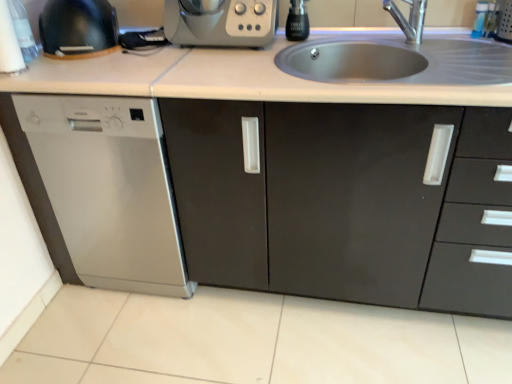
The image size is (512, 384). Describe the element at coordinates (401, 62) in the screenshot. I see `stainless steel sink at upper center` at that location.

The height and width of the screenshot is (384, 512). What do you see at coordinates (297, 21) in the screenshot? I see `black glass bottle at upper center, the second appliance viewed from the left` at bounding box center [297, 21].

This screenshot has width=512, height=384. What are the coordinates of `satin silver appliance at upper center` in the screenshot? It's located at (221, 22).

Considering the relative sizes of satin silver appliance at upper center and stainless steel sink at upper center in the image provided, is satin silver appliance at upper center thinner than stainless steel sink at upper center?

Indeed, satin silver appliance at upper center has a lesser width compared to stainless steel sink at upper center.

Is satin silver appliance at upper center in front of or behind stainless steel sink at upper center in the image?

satin silver appliance at upper center is positioned farther from the viewer than stainless steel sink at upper center.

Could you tell me if satin silver appliance at upper center is facing stainless steel sink at upper center?

No, satin silver appliance at upper center is not turned towards stainless steel sink at upper center.

Who is smaller, matte black cabinet at center or satin steel dishwasher at left?

satin steel dishwasher at left is smaller.

Is matte black cabinet at center facing away from satin steel dishwasher at left?

No.

Consider the image. Which of these two, matte black cabinet at center or satin steel dishwasher at left, stands shorter?

matte black cabinet at center is shorter.

Who is more distant, matte black cabinet at center or satin steel dishwasher at left?

Positioned behind is satin steel dishwasher at left.

Is silver metallic faucet at upper center located outside matte black cabinet at center?

Absolutely, silver metallic faucet at upper center is external to matte black cabinet at center.

Is the depth of silver metallic faucet at upper center less than that of matte black cabinet at center?

No, it is behind matte black cabinet at center.

From the image's perspective, is silver metallic faucet at upper center positioned above or below matte black cabinet at center?

From the image's perspective, silver metallic faucet at upper center appears above matte black cabinet at center.

Can you confirm if black glass bottle at upper center, the second appliance viewed from the left, is thinner than silver metallic faucet at upper center?

Yes, black glass bottle at upper center, the second appliance viewed from the left, is thinner than silver metallic faucet at upper center.

Is the position of black glass bottle at upper center, acting as the first appliance starting from the right, more distant than that of silver metallic faucet at upper center?

That is True.

Can you tell me how much black glass bottle at upper center, acting as the first appliance starting from the right, and silver metallic faucet at upper center differ in facing direction?

The angle between the facing direction of black glass bottle at upper center, acting as the first appliance starting from the right, and the facing direction of silver metallic faucet at upper center is 51.2 degrees.

Measure the distance from black glass bottle at upper center, the second appliance viewed from the left, to silver metallic faucet at upper center.

black glass bottle at upper center, the second appliance viewed from the left, is 13.24 inches from silver metallic faucet at upper center.

From a real-world perspective, which is physically below, satin silver appliance at upper center or matte black kettle at upper left, the second appliance when ordered from right to left?

satin silver appliance at upper center is physically lower.

I want to click on kitchen appliance in front of the matte black kettle at upper left, which is the 1th appliance in left-to-right order, so click(221, 22).

Is satin silver appliance at upper center turned away from matte black kettle at upper left, which is the 1th appliance in left-to-right order?

No, matte black kettle at upper left, which is the 1th appliance in left-to-right order, is not at the back of satin silver appliance at upper center.

Between satin silver appliance at upper center and matte black kettle at upper left, the second appliance when ordered from right to left, which one has less height?

With less height is satin silver appliance at upper center.

The width and height of the screenshot is (512, 384). Identify the location of sink located above the satin steel dishwasher at left (from the image's perspective). (401, 62).

Is stainless steel sink at upper center oriented towards satin steel dishwasher at left?

No, stainless steel sink at upper center is not facing towards satin steel dishwasher at left.

Between stainless steel sink at upper center and satin steel dishwasher at left, which one has more height?

With more height is satin steel dishwasher at left.

Is point (459, 49) closer to viewer compared to point (41, 160)?

No, it is behind (41, 160).

From a real-world perspective, between satin steel dishwasher at left and silver metallic faucet at upper center, who is vertically lower?

In real-world perspective, satin steel dishwasher at left is lower.

From the image's perspective, does satin steel dishwasher at left appear higher than silver metallic faucet at upper center?

No.

Which of these two, satin steel dishwasher at left or silver metallic faucet at upper center, is bigger?

Bigger between the two is satin steel dishwasher at left.

Is satin steel dishwasher at left facing towards silver metallic faucet at upper center?

No.

This screenshot has width=512, height=384. Find the location of `kitchen appliance located behind the stainless steel sink at upper center`. kitchen appliance located behind the stainless steel sink at upper center is located at coordinates (221, 22).

The height and width of the screenshot is (384, 512). I want to click on home appliance located on the left of matte black cabinet at center, so click(106, 189).

Considering their positions, is black glass bottle at upper center, acting as the first appliance starting from the right, positioned further to stainless steel sink at upper center than matte black cabinet at center?

The object further to stainless steel sink at upper center is matte black cabinet at center.

Looking at the image, which one is located further to silver metallic faucet at upper center, matte black kettle at upper left, the second appliance when ordered from right to left, or stainless steel sink at upper center?

Based on the image, matte black kettle at upper left, the second appliance when ordered from right to left, appears to be further to silver metallic faucet at upper center.

Looking at this image, which object lies further to the anchor point black glass bottle at upper center, acting as the first appliance starting from the right, matte black kettle at upper left, the second appliance when ordered from right to left, or matte black cabinet at center?

matte black cabinet at center.

Based on their spatial positions, is black glass bottle at upper center, acting as the first appliance starting from the right, or stainless steel sink at upper center further from satin silver appliance at upper center?

stainless steel sink at upper center.

From the image, which object appears to be farther from satin silver appliance at upper center, silver metallic faucet at upper center or stainless steel sink at upper center?

Based on the image, silver metallic faucet at upper center appears to be further to satin silver appliance at upper center.

Estimate the real-world distances between objects in this image. Which object is closer to stainless steel sink at upper center, matte black cabinet at center or black glass bottle at upper center, the second appliance viewed from the left?

Based on the image, black glass bottle at upper center, the second appliance viewed from the left, appears to be nearer to stainless steel sink at upper center.

Estimate the real-world distances between objects in this image. Which object is closer to matte black kettle at upper left, which is the 1th appliance in left-to-right order, silver metallic faucet at upper center or black glass bottle at upper center, acting as the first appliance starting from the right?

Among the two, black glass bottle at upper center, acting as the first appliance starting from the right, is located nearer to matte black kettle at upper left, which is the 1th appliance in left-to-right order.

Estimate the real-world distances between objects in this image. Which object is further from stainless steel sink at upper center, matte black cabinet at center or satin steel dishwasher at left?

satin steel dishwasher at left is positioned further to the anchor stainless steel sink at upper center.

Where is `sink between silver metallic faucet at upper center and matte black cabinet at center from top to bottom`? The height and width of the screenshot is (384, 512). sink between silver metallic faucet at upper center and matte black cabinet at center from top to bottom is located at coordinates (401, 62).

Identify the location of kitchen appliance between satin steel dishwasher at left and matte black cabinet at center. (221, 22).

In order to click on home appliance situated between matte black kettle at upper left, the second appliance when ordered from right to left, and stainless steel sink at upper center from left to right in this screenshot , I will do `click(106, 189)`.

This screenshot has width=512, height=384. Find the location of `kitchen appliance located between matte black kettle at upper left, which is the 1th appliance in left-to-right order, and matte black cabinet at center in the left-right direction`. kitchen appliance located between matte black kettle at upper left, which is the 1th appliance in left-to-right order, and matte black cabinet at center in the left-right direction is located at coordinates (221, 22).